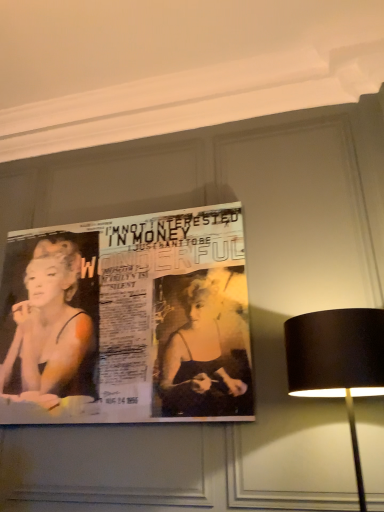
Where is `black fabric lampshade at right`? Image resolution: width=384 pixels, height=512 pixels. black fabric lampshade at right is located at coordinates tap(337, 362).

Image resolution: width=384 pixels, height=512 pixels. Describe the element at coordinates (337, 362) in the screenshot. I see `black fabric lampshade at right` at that location.

This screenshot has width=384, height=512. What do you see at coordinates (127, 321) in the screenshot?
I see `matte paper poster at upper center` at bounding box center [127, 321].

Locate an element on the screen. The height and width of the screenshot is (512, 384). matte paper poster at upper center is located at coordinates (127, 321).

Identify the location of black fabric lampshade at right. (337, 362).

Considering the positions of objects black fabric lampshade at right and matte paper poster at upper center in the image provided, who is more to the right, black fabric lampshade at right or matte paper poster at upper center?

black fabric lampshade at right.

Who is more distant, black fabric lampshade at right or matte paper poster at upper center?

matte paper poster at upper center is further away from the camera.

Looking at this image, which is closer, (354, 451) or (81, 383)?

The point (354, 451) is closer to the camera.

From the image's perspective, who appears lower, black fabric lampshade at right or matte paper poster at upper center?

From the image's view, black fabric lampshade at right is below.

In the scene shown: From a real-world perspective, is black fabric lampshade at right positioned under matte paper poster at upper center based on gravity?

Correct, in the physical world, black fabric lampshade at right is lower than matte paper poster at upper center.

Does black fabric lampshade at right have a greater width compared to matte paper poster at upper center?

Yes, black fabric lampshade at right is wider than matte paper poster at upper center.

Considering the relative sizes of black fabric lampshade at right and matte paper poster at upper center in the image provided, is black fabric lampshade at right taller than matte paper poster at upper center?

In fact, black fabric lampshade at right may be shorter than matte paper poster at upper center.

Considering the sizes of black fabric lampshade at right and matte paper poster at upper center in the image, is black fabric lampshade at right bigger or smaller than matte paper poster at upper center?

black fabric lampshade at right is bigger than matte paper poster at upper center.

Would you say black fabric lampshade at right is inside or outside matte paper poster at upper center?

black fabric lampshade at right is outside matte paper poster at upper center.

Is black fabric lampshade at right with matte paper poster at upper center?

No, black fabric lampshade at right is not making contact with matte paper poster at upper center.

Is black fabric lampshade at right oriented towards matte paper poster at upper center?

No, black fabric lampshade at right is not oriented towards matte paper poster at upper center.

What's the angular difference between black fabric lampshade at right and matte paper poster at upper center's facing directions?

They differ by 0.287 degrees in their facing directions.

Consider the image. Measure the distance from black fabric lampshade at right to matte paper poster at upper center.

black fabric lampshade at right is 3.38 feet away from matte paper poster at upper center.

Where is `lamp in front of the matte paper poster at upper center`? The height and width of the screenshot is (512, 384). lamp in front of the matte paper poster at upper center is located at coordinates (337, 362).

Considering the positions of objects matte paper poster at upper center and black fabric lampshade at right in the image provided, who is more to the left, matte paper poster at upper center or black fabric lampshade at right?

Positioned to the left is matte paper poster at upper center.

Between matte paper poster at upper center and black fabric lampshade at right, which one is positioned behind?

matte paper poster at upper center is behind.

Which is behind, point (165, 217) or point (360, 394)?

The point (165, 217) is more distant.

From the image's perspective, relative to black fabric lampshade at right, is matte paper poster at upper center above or below?

Clearly, from the image's perspective, matte paper poster at upper center is above black fabric lampshade at right.

From a real-world perspective, is matte paper poster at upper center located beneath black fabric lampshade at right?

No, from a real-world perspective, matte paper poster at upper center is not under black fabric lampshade at right.

Can you confirm if matte paper poster at upper center is wider than black fabric lampshade at right?

Incorrect, the width of matte paper poster at upper center does not surpass that of black fabric lampshade at right.

Who is taller, matte paper poster at upper center or black fabric lampshade at right?

matte paper poster at upper center is taller.

Between matte paper poster at upper center and black fabric lampshade at right, which one has larger size?

black fabric lampshade at right.

Is matte paper poster at upper center spatially inside black fabric lampshade at right, or outside of it?

matte paper poster at upper center is located beyond the bounds of black fabric lampshade at right.

Is matte paper poster at upper center beside black fabric lampshade at right?

matte paper poster at upper center is not next to black fabric lampshade at right, and they're not touching.

Is matte paper poster at upper center facing towards black fabric lampshade at right?

No, matte paper poster at upper center is not turned towards black fabric lampshade at right.

How many degrees apart are the facing directions of matte paper poster at upper center and black fabric lampshade at right?

They differ by 0.287 degrees in their facing directions.

How far apart are matte paper poster at upper center and black fabric lampshade at right?

matte paper poster at upper center and black fabric lampshade at right are 3.38 feet apart.

At what (x,y) coordinates should I click in order to perform the action: click on poster that appears above the black fabric lampshade at right (from a real-world perspective). Please return your answer as a coordinate pair (x, y). Looking at the image, I should click on (127, 321).

The width and height of the screenshot is (384, 512). I want to click on lamp located on the right of matte paper poster at upper center, so click(x=337, y=362).

This screenshot has height=512, width=384. In order to click on poster that is above the black fabric lampshade at right (from a real-world perspective) in this screenshot , I will do `click(127, 321)`.